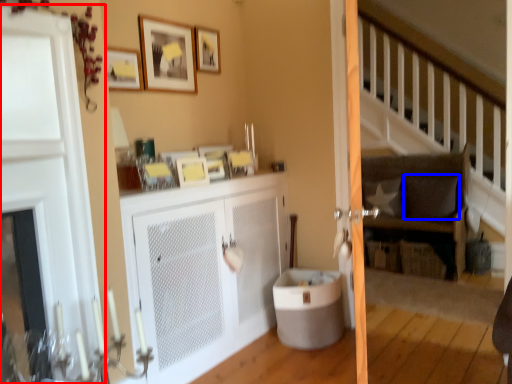
Question: Which object appears farthest to the camera in this image, door (highlighted by a red box) or pillow (highlighted by a blue box)?

Choices:
 (A) door
 (B) pillow

Answer: (B)